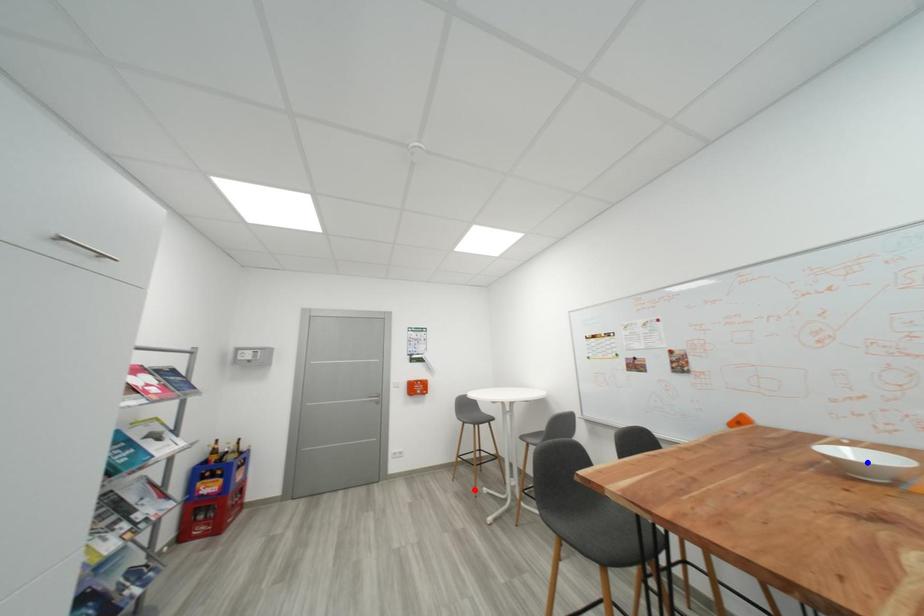
Question: Two points are marked on the image. Which point is closer to the camera?

Choices:
 (A) Blue point is closer.
 (B) Red point is closer.

Answer: (A)